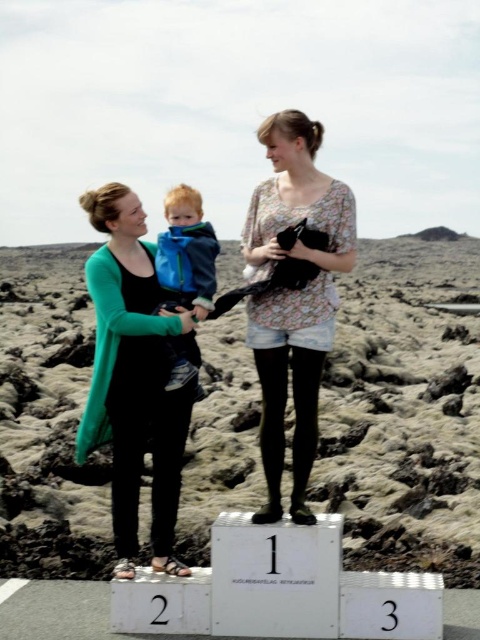
Looking at this image, can you confirm if floral-patterned shirt at center is positioned above blue fleece jacket at center?

No, floral-patterned shirt at center is not above blue fleece jacket at center.

Is point (267, 189) more distant than point (191, 365)?

Yes.

Describe the element at coordinates (294, 298) in the screenshot. I see `floral-patterned shirt at center` at that location.

This screenshot has width=480, height=640. I want to click on floral-patterned shirt at center, so (x=294, y=298).

Where is `green matte cardigan at left`? This screenshot has height=640, width=480. green matte cardigan at left is located at coordinates (133, 378).

Image resolution: width=480 pixels, height=640 pixels. I want to click on green matte cardigan at left, so click(x=133, y=378).

Who is shorter, green matte cardigan at left or floral-patterned shirt at center?

Standing shorter between the two is green matte cardigan at left.

Who is more distant from viewer, (132, 346) or (324, 320)?

Positioned behind is point (132, 346).

The height and width of the screenshot is (640, 480). Identify the location of green matte cardigan at left. (133, 378).